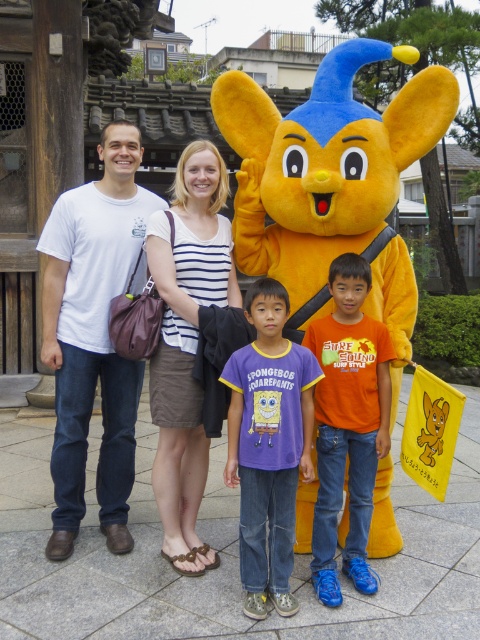
Question: Is white striped shirt at center above purple cotton shirt at center?

Choices:
 (A) no
 (B) yes

Answer: (B)

Question: Which point is closer to the camera?

Choices:
 (A) purple cotton shirt at center
 (B) yellow plush mascot at center
 (C) white cotton t-shirt at left

Answer: (A)

Question: Does white cotton t-shirt at left appear on the right side of purple cotton shirt at center?

Choices:
 (A) yes
 (B) no

Answer: (B)

Question: Estimate the real-world distances between objects in this image. Which object is farther from the white cotton t-shirt at left?

Choices:
 (A) orange cotton shirt at center
 (B) purple cotton shirt at center
 (C) white striped shirt at center

Answer: (A)

Question: Which is farther from the purple cotton shirt at center?

Choices:
 (A) white cotton t-shirt at left
 (B) white striped shirt at center
 (C) yellow plush mascot at center

Answer: (A)

Question: Can you confirm if purple cotton shirt at center is bigger than orange cotton shirt at center?

Choices:
 (A) yes
 (B) no

Answer: (A)